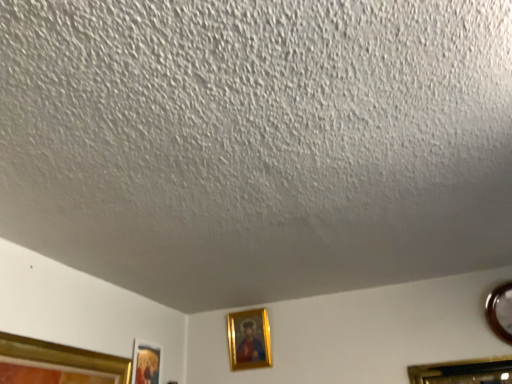
Question: From a real-world perspective, is metallic circular frame at right, the third picture frame in the left-to-right sequence, physically above gold-framed picture at center, acting as the 2th picture frame starting from the right?

Choices:
 (A) no
 (B) yes

Answer: (A)

Question: Is metallic circular frame at right, the third picture frame in the left-to-right sequence, taller than gold-framed picture at center, acting as the 2th picture frame starting from the right?

Choices:
 (A) no
 (B) yes

Answer: (A)

Question: Considering the relative sizes of metallic circular frame at right, the third picture frame in the left-to-right sequence, and gold-framed picture at center, the second picture frame positioned from the left, in the image provided, is metallic circular frame at right, the third picture frame in the left-to-right sequence, smaller than gold-framed picture at center, the second picture frame positioned from the left,?

Choices:
 (A) yes
 (B) no

Answer: (B)

Question: Are metallic circular frame at right, the third picture frame in the left-to-right sequence, and gold-framed picture at center, acting as the 2th picture frame starting from the right, beside each other?

Choices:
 (A) no
 (B) yes

Answer: (A)

Question: From the image's perspective, is metallic circular frame at right, which is counted as the 1th picture frame, starting from the right, located beneath gold-framed picture at center, the second picture frame positioned from the left?

Choices:
 (A) no
 (B) yes

Answer: (A)

Question: In terms of height, does gold-framed picture at center, the second picture frame positioned from the left, look taller or shorter compared to metallic circular frame at right, which is counted as the 1th picture frame, starting from the right?

Choices:
 (A) tall
 (B) short

Answer: (A)

Question: Is point (243, 334) closer or farther from the camera than point (507, 296)?

Choices:
 (A) closer
 (B) farther

Answer: (B)

Question: Is gold-framed picture at center, the second picture frame positioned from the left, in front of or behind metallic circular frame at right, which is counted as the 1th picture frame, starting from the right, in the image?

Choices:
 (A) behind
 (B) front

Answer: (A)

Question: Considering the positions of gold-framed picture at center, the second picture frame positioned from the left, and metallic circular frame at right, which is counted as the 1th picture frame, starting from the right, in the image, is gold-framed picture at center, the second picture frame positioned from the left, wider or thinner than metallic circular frame at right, which is counted as the 1th picture frame, starting from the right,?

Choices:
 (A) thin
 (B) wide

Answer: (A)

Question: Considering the positions of metallic circular frame at right, the third picture frame in the left-to-right sequence, and gold-framed picture at center, the second picture frame positioned from the left, in the image, is metallic circular frame at right, the third picture frame in the left-to-right sequence, bigger or smaller than gold-framed picture at center, the second picture frame positioned from the left,?

Choices:
 (A) big
 (B) small

Answer: (A)

Question: Would you say metallic circular frame at right, which is counted as the 1th picture frame, starting from the right, is to the left or to the right of gold-framed picture at center, the second picture frame positioned from the left, in the picture?

Choices:
 (A) left
 (B) right

Answer: (B)

Question: Is metallic circular frame at right, which is counted as the 1th picture frame, starting from the right, taller or shorter than gold-framed picture at center, acting as the 2th picture frame starting from the right?

Choices:
 (A) tall
 (B) short

Answer: (B)

Question: Considering the positions of point (489, 296) and point (239, 359), is point (489, 296) closer or farther from the camera than point (239, 359)?

Choices:
 (A) closer
 (B) farther

Answer: (A)

Question: Looking at their shapes, would you say gold-framed picture at lower left, positioned as the third picture frame in right-to-left order, is wider or thinner than gold-framed picture at center, acting as the 2th picture frame starting from the right?

Choices:
 (A) wide
 (B) thin

Answer: (B)

Question: From the image's perspective, is gold-framed picture at lower left, the 1th picture frame positioned from the left, positioned above or below gold-framed picture at center, the second picture frame positioned from the left?

Choices:
 (A) above
 (B) below

Answer: (B)